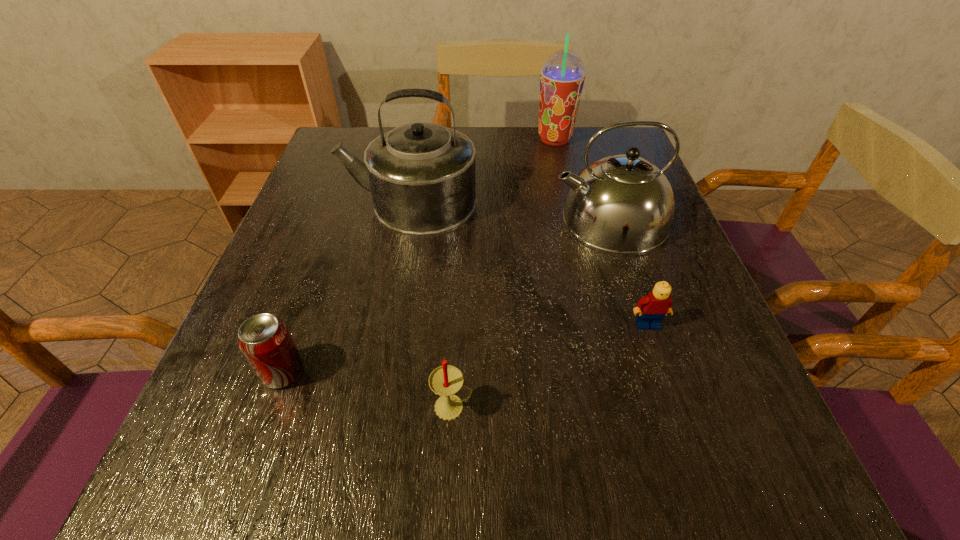
The width and height of the screenshot is (960, 540). Find the location of `kettle present at the right edge`. kettle present at the right edge is located at coordinates (623, 204).

Where is `Lego that is positioned at the right edge`? Lego that is positioned at the right edge is located at coordinates (655, 306).

This screenshot has width=960, height=540. In order to click on object that is at the far left corner in this screenshot , I will do `click(421, 175)`.

You are a GUI agent. You are given a task and a screenshot of the screen. Output one action in this format:
    pyautogui.click(x=<x>, y=<y>)
    Task: Click on the object that is at the far right corner
    The image size is (960, 540).
    Given the screenshot: What is the action you would take?
    pyautogui.click(x=562, y=77)

This screenshot has height=540, width=960. I want to click on blank space at the far edge of the desktop, so click(x=510, y=139).

Identify the location of free location at the left edge. The height and width of the screenshot is (540, 960). (269, 292).

This screenshot has width=960, height=540. In the image, there is a desktop. Identify the location of free space at the right edge. (684, 303).

This screenshot has height=540, width=960. I want to click on free location at the far left corner of the desktop, so click(x=374, y=136).

Identify the location of vacant space at the far right corner of the desktop. This screenshot has height=540, width=960. (594, 148).

This screenshot has height=540, width=960. In the image, there is a desktop. What are the coordinates of `vacant space at the near right corner` in the screenshot? It's located at (767, 475).